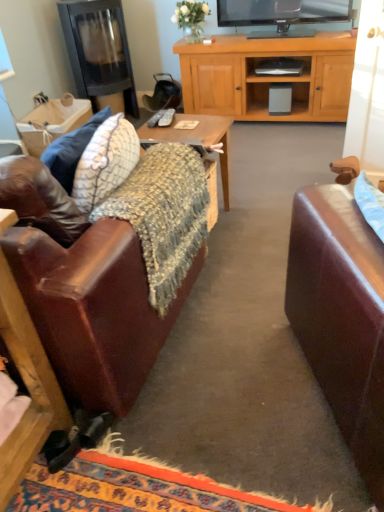
Where is `spots to the right of leather couch at left`? This screenshot has width=384, height=512. spots to the right of leather couch at left is located at coordinates (253, 305).